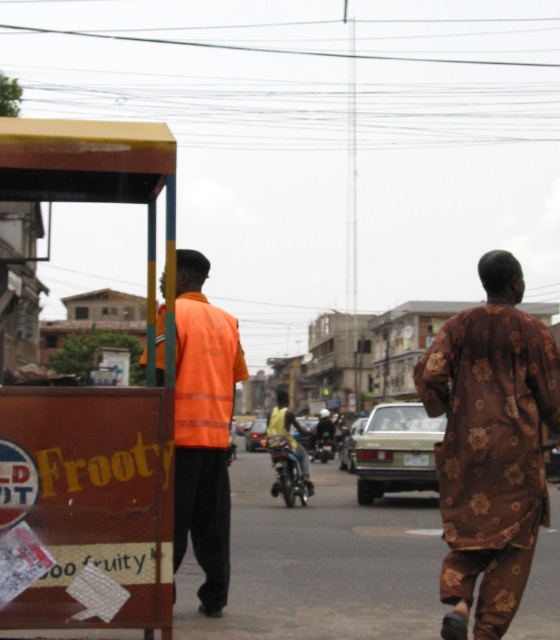
Question: Is brown floral fabric robe at right wider than yellow metallic motorcycle at center?

Choices:
 (A) no
 (B) yes

Answer: (B)

Question: Among these points, which one is nearest to the camera?

Choices:
 (A) (291, 474)
 (B) (202, 492)
 (C) (511, 548)

Answer: (C)

Question: Is brown floral fabric robe at right smaller than yellow metallic motorcycle at center?

Choices:
 (A) no
 (B) yes

Answer: (A)

Question: Among these objects, which one is nearest to the camera?

Choices:
 (A) yellow metallic motorcycle at center
 (B) orange reflective vest at center

Answer: (B)

Question: Can you confirm if orange reflective vest at center is positioned to the right of yellow metallic motorcycle at center?

Choices:
 (A) no
 (B) yes

Answer: (A)

Question: Which of the following is the closest to the observer?

Choices:
 (A) brown floral fabric robe at right
 (B) yellow metallic motorcycle at center
 (C) orange reflective vest at center

Answer: (C)